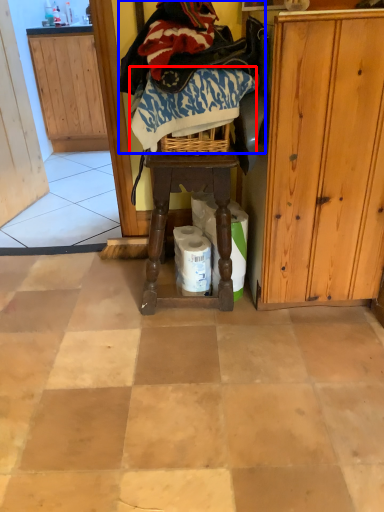
Question: Which object is further to the camera taking this photo, clothing (highlighted by a red box) or clothing (highlighted by a blue box)?

Choices:
 (A) clothing
 (B) clothing

Answer: (A)